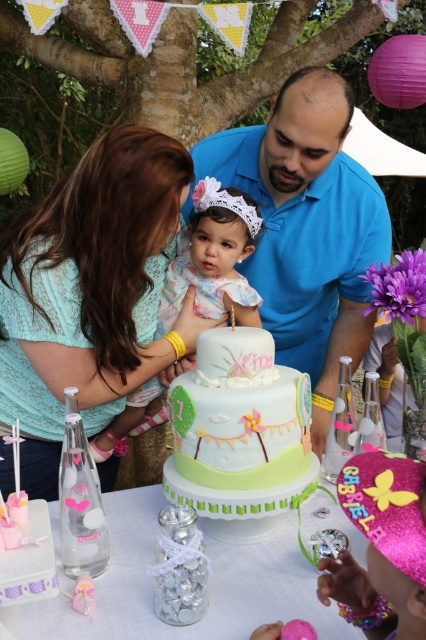
Question: Can you confirm if pastel fondant cake at center is positioned to the left of pastel floral dress at center?

Choices:
 (A) yes
 (B) no

Answer: (B)

Question: Among these objects, which one is nearest to the camera?

Choices:
 (A) matte green cake at center
 (B) blue smooth shirt at center
 (C) matte teal lace dress at upper left

Answer: (A)

Question: Is matte teal lace dress at upper left positioned before matte green cake at center?

Choices:
 (A) no
 (B) yes

Answer: (A)

Question: Which of the following is the farthest from the observer?

Choices:
 (A) pos(207,214)
 (B) pos(117,531)
 (C) pos(287,385)

Answer: (A)

Question: Which of the following is the closest to the observer?

Choices:
 (A) (118, 432)
 (B) (268, 458)

Answer: (B)

Question: Is blue smooth shirt at center positioned behind matte green cake at center?

Choices:
 (A) no
 (B) yes

Answer: (B)